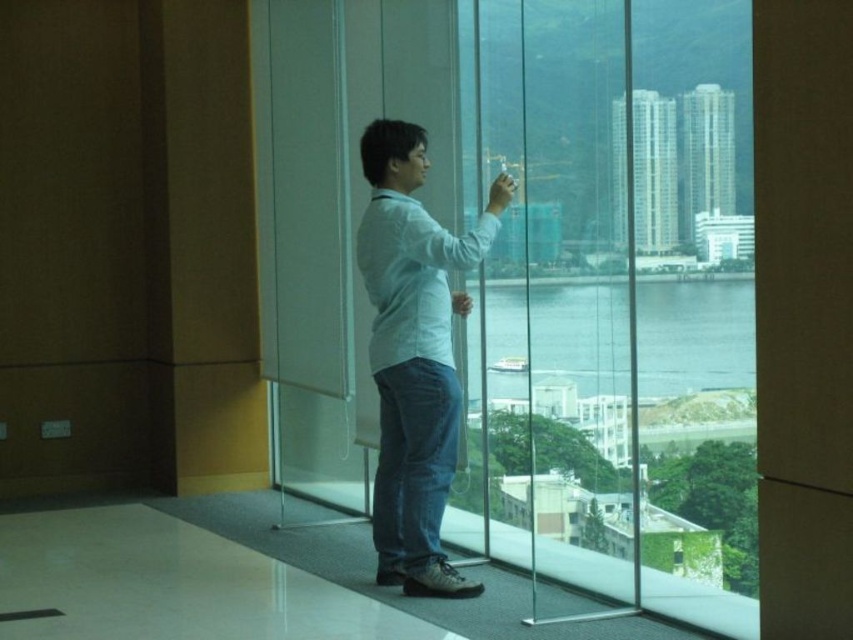
Question: Can you confirm if transparent glass door at center is thinner than light blue denim jeans at center?

Choices:
 (A) yes
 (B) no

Answer: (B)

Question: In this image, where is transparent glass door at center located relative to light blue denim jeans at center?

Choices:
 (A) right
 (B) left

Answer: (A)

Question: In this image, where is transparent glass door at center located relative to light blue denim jeans at center?

Choices:
 (A) left
 (B) right

Answer: (B)

Question: Among these points, which one is farthest from the camera?

Choices:
 (A) (415, 429)
 (B) (706, 125)

Answer: (B)